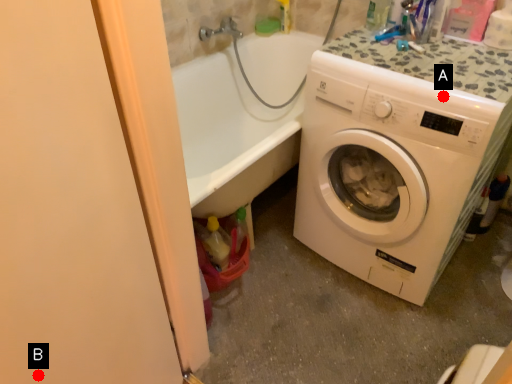
Question: Two points are circled on the image, labeled by A and B beside each circle. Which point is farther from the camera taking this photo?

Choices:
 (A) A is further
 (B) B is further

Answer: (A)